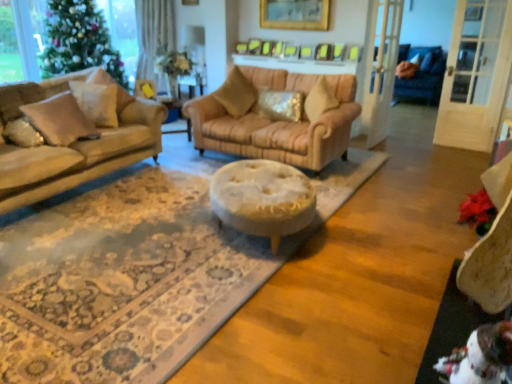
Question: Is velvet beige swivel chair at lower right positioned in front of beige fabric pillow at left, the 4th pillow positioned from the right?

Choices:
 (A) no
 (B) yes

Answer: (B)

Question: Is velvet beige swivel chair at lower right directly adjacent to beige fabric pillow at left, the 2th pillow viewed from the left?

Choices:
 (A) no
 (B) yes

Answer: (A)

Question: From a real-world perspective, is velvet beige swivel chair at lower right located higher than beige fabric pillow at left, the 2th pillow viewed from the left?

Choices:
 (A) no
 (B) yes

Answer: (B)

Question: Is velvet beige swivel chair at lower right wider than beige fabric pillow at left, the 2th pillow viewed from the left?

Choices:
 (A) yes
 (B) no

Answer: (B)

Question: Does velvet beige swivel chair at lower right turn towards beige fabric pillow at left, the 4th pillow positioned from the right?

Choices:
 (A) no
 (B) yes

Answer: (A)

Question: Is beige fabric pillow at left, which is the 3th pillow in left-to-right order, in front of or behind metallic sequined pillow at center, placed as the 5th pillow when sorted from left to right, in the image?

Choices:
 (A) behind
 (B) front

Answer: (B)

Question: Choose the correct answer: Is beige fabric pillow at left, the third pillow when ordered from right to left, inside metallic sequined pillow at center, placed as the 5th pillow when sorted from left to right, or outside it?

Choices:
 (A) outside
 (B) inside

Answer: (A)

Question: Looking at their shapes, would you say beige fabric pillow at left, which is the 3th pillow in left-to-right order, is wider or thinner than metallic sequined pillow at center, arranged as the 1th pillow when viewed from the right?

Choices:
 (A) thin
 (B) wide

Answer: (B)

Question: From the image's perspective, relative to metallic sequined pillow at center, arranged as the 1th pillow when viewed from the right, is beige fabric pillow at left, the third pillow when ordered from right to left, above or below?

Choices:
 (A) above
 (B) below

Answer: (A)

Question: Is beige fabric pillow at center, the 4th pillow in the left-to-right sequence, bigger or smaller than green matte christmas tree at left?

Choices:
 (A) small
 (B) big

Answer: (A)

Question: Would you say beige fabric pillow at center, the 2th pillow when ordered from right to left, is to the left or to the right of green matte christmas tree at left in the picture?

Choices:
 (A) left
 (B) right

Answer: (B)

Question: In terms of height, does beige fabric pillow at center, the 2th pillow when ordered from right to left, look taller or shorter compared to green matte christmas tree at left?

Choices:
 (A) short
 (B) tall

Answer: (A)

Question: From a real-world perspective, relative to green matte christmas tree at left, is beige fabric pillow at center, the 4th pillow in the left-to-right sequence, vertically above or below?

Choices:
 (A) below
 (B) above

Answer: (A)

Question: In the image, is matte gold pillow at left, the 1th pillow in the left-to-right sequence, on the left side or the right side of velvet beige swivel chair at lower right?

Choices:
 (A) right
 (B) left

Answer: (B)

Question: Is matte gold pillow at left, the 5th pillow in the right-to-left sequence, inside or outside of velvet beige swivel chair at lower right?

Choices:
 (A) outside
 (B) inside

Answer: (A)